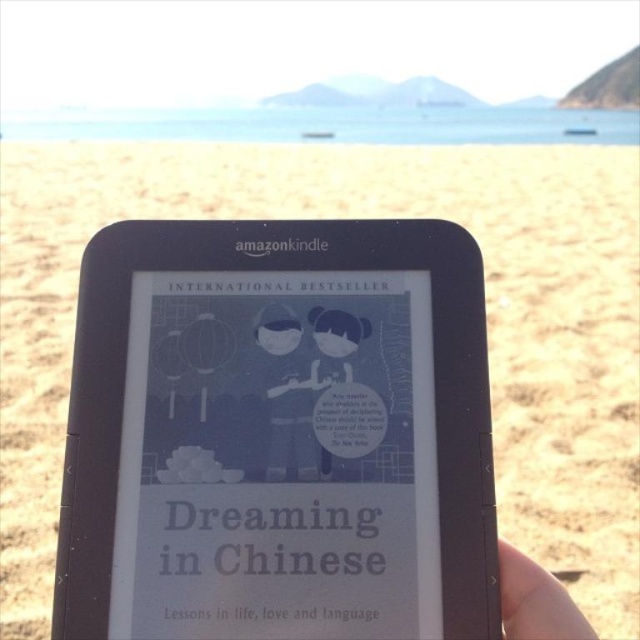
Question: Among these points, which one is nearest to the camera?

Choices:
 (A) (324, 452)
 (B) (500, 595)

Answer: (B)

Question: Can you confirm if smooth skin hand at lower right is positioned to the right of matte blue character at center?

Choices:
 (A) no
 (B) yes

Answer: (B)

Question: Does smooth skin hand at lower right appear over matte blue character at center?

Choices:
 (A) yes
 (B) no

Answer: (B)

Question: Which point is farther to the camera?

Choices:
 (A) (522, 605)
 (B) (330, 454)

Answer: (B)

Question: Can you confirm if smooth skin hand at lower right is positioned above matte blue character at center?

Choices:
 (A) no
 (B) yes

Answer: (A)

Question: Which point is closer to the camera taking this photo?

Choices:
 (A) (355, 346)
 (B) (524, 621)

Answer: (B)